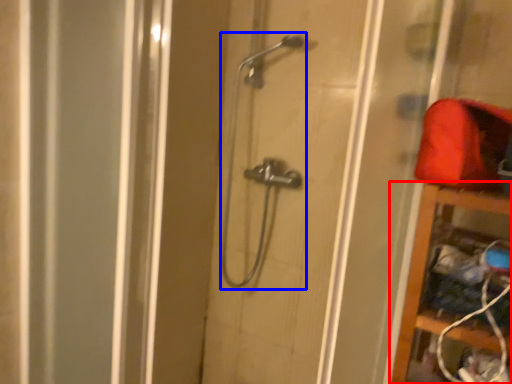
Question: Which point is further to the camera, cabinet (highlighted by a red box) or shower (highlighted by a blue box)?

Choices:
 (A) cabinet
 (B) shower

Answer: (B)